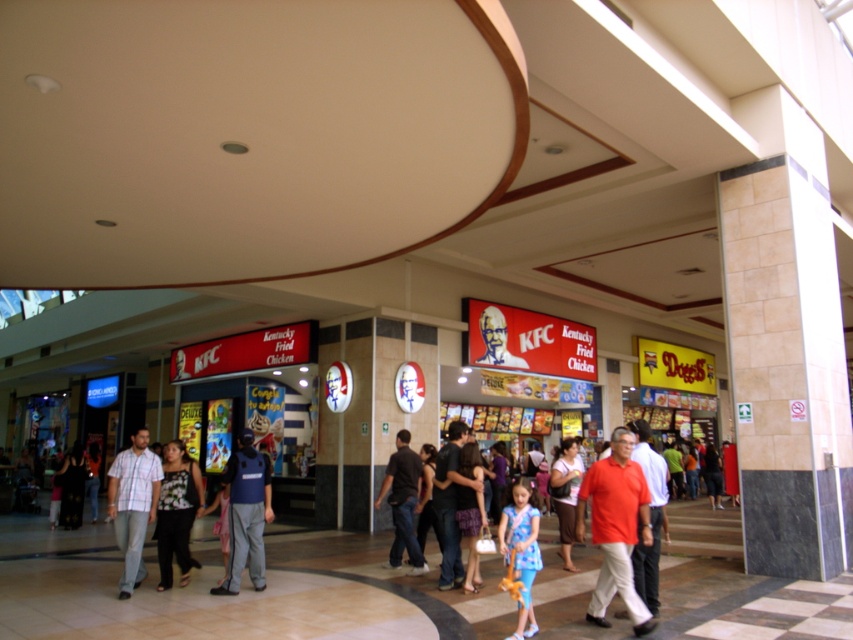
Question: Can you confirm if plaid shirt at center is positioned above matte red shirt at center?

Choices:
 (A) no
 (B) yes

Answer: (A)

Question: From the image, what is the correct spatial relationship of dark blue uniform at center in relation to dark brown leather jacket at center?

Choices:
 (A) left
 (B) right

Answer: (A)

Question: Among these points, which one is farthest from the camera?

Choices:
 (A) (456, 525)
 (B) (517, 627)
 (C) (419, 460)
 (D) (613, 576)

Answer: (C)

Question: Is matte orange shirt at center in front of black cotton shirt at center?

Choices:
 (A) yes
 (B) no

Answer: (A)

Question: Which of the following is the closest to the observer?

Choices:
 (A) (637, 634)
 (B) (457, 577)
 (C) (656, 593)

Answer: (A)

Question: Which point is closer to the camera?

Choices:
 (A) black cotton shirt at center
 (B) dark blue uniform at center
 (C) matte orange shirt at center

Answer: (C)